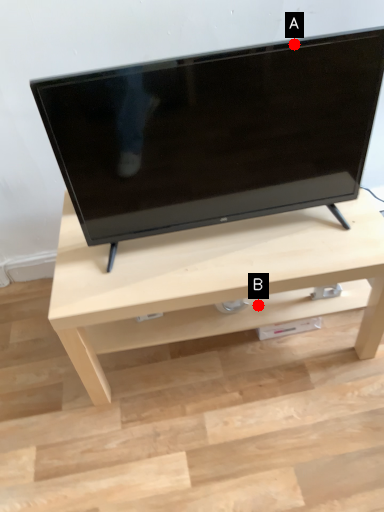
Question: Two points are circled on the image, labeled by A and B beside each circle. Which point is closer to the camera?

Choices:
 (A) A is closer
 (B) B is closer

Answer: (A)